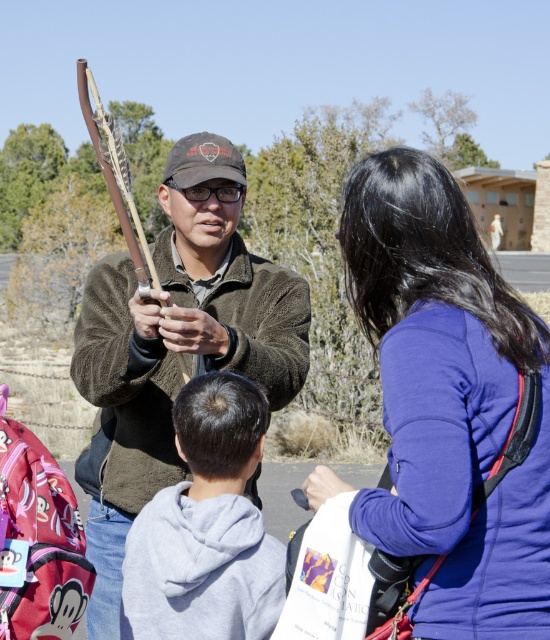
You are standing in the outdoor scene and want to hand a brochure to the person wearing the dark brown fuzzy jacket at center. The wooden bow at center is blocking your path. Can you reach the jacket without moving the bow?

The dark brown fuzzy jacket at center is closer to the viewer than the wooden bow at center, so you can reach the jacket without moving the bow since it is in front of the bow.

You are attending an outdoor event and need to locate two people based on their clothing. The first person is wearing a purple fleece jacket at upper right, and the second is wearing a gray fleece hoodie at lower center. Which of these two individuals is positioned more to the right side of the scene?

The purple fleece jacket at upper right is positioned more to the right side of the scene compared to the gray fleece hoodie at lower center.

You are a photographer at the event and want to capture a photo that includes both the purple fleece jacket at upper right and the gray fleece hoodie at lower center. Which one should you focus on first to ensure both are in the frame?

You should focus on the gray fleece hoodie at lower center first because the purple fleece jacket at upper right is in front of it, so adjusting the focus starting from the closer object will help include both in the frame.